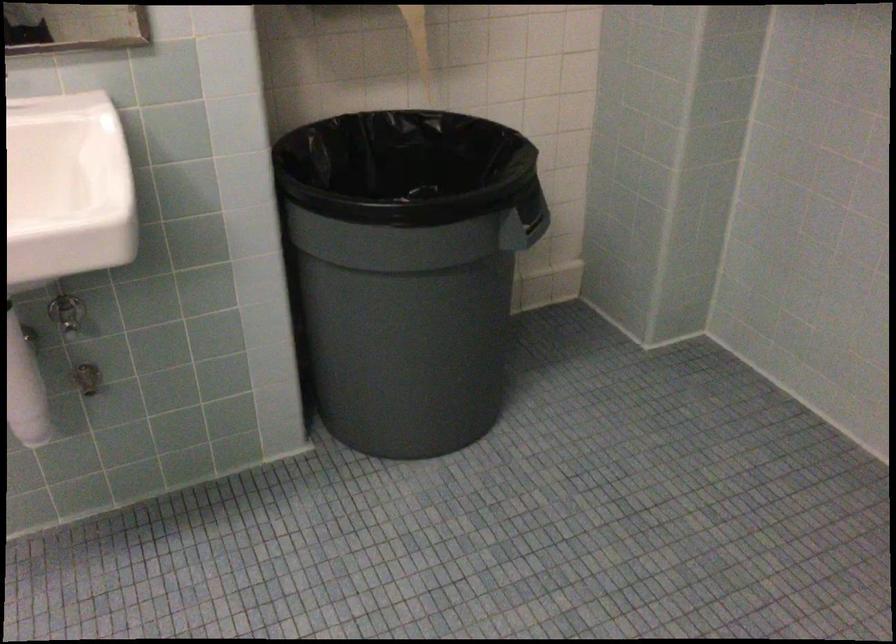
The first image is from the beginning of the video and the second image is from the end. How did the camera likely rotate when shooting the video?

The camera's rotation is toward left-down.